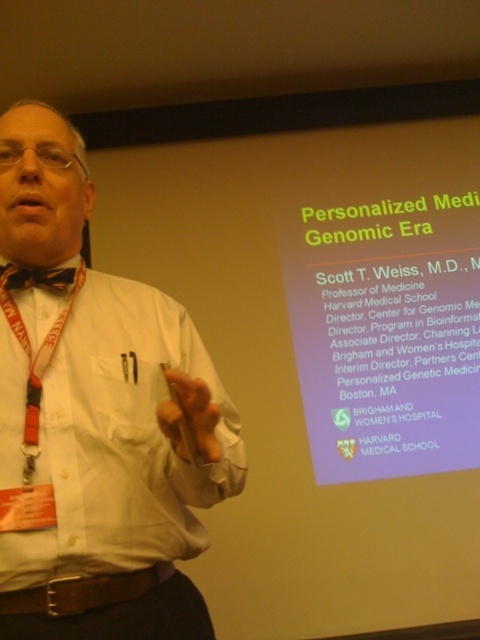
Does matte black bow tie at left have a greater width compared to brown textured bow tie at center?

Indeed, matte black bow tie at left has a greater width compared to brown textured bow tie at center.

Who is more distant from viewer, (172, 625) or (27, 275)?

Point (27, 275)

Who is more forward, (46, 468) or (47, 269)?

Point (46, 468) is more forward.

In order to click on matte black bow tie at left in this screenshot , I will do `click(96, 420)`.